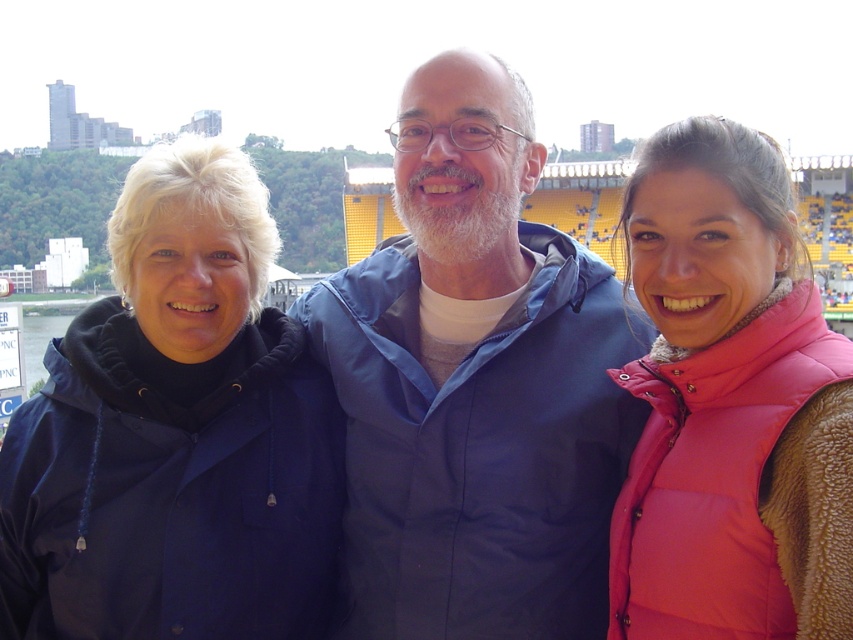
Identify the location of blue fabric jacket at center. The height and width of the screenshot is (640, 853). (474, 384).

This screenshot has width=853, height=640. Describe the element at coordinates (474, 384) in the screenshot. I see `blue fabric jacket at center` at that location.

Does point (387, 280) lie behind point (762, 432)?

That is True.

At what (x,y) coordinates should I click in order to perform the action: click on blue fabric jacket at center. Please return your answer as a coordinate pair (x, y). This screenshot has height=640, width=853. Looking at the image, I should click on (474, 384).

Between blue fabric jacket at center and navy blue jacket at left, which one is positioned higher?

blue fabric jacket at center is above.

Which of these two, blue fabric jacket at center or navy blue jacket at left, stands taller?

blue fabric jacket at center is taller.

Does point (405, 211) lie behind point (328, 509)?

Yes, it is behind point (328, 509).

At what (x,y) coordinates should I click in order to perform the action: click on blue fabric jacket at center. Please return your answer as a coordinate pair (x, y). Looking at the image, I should click on (474, 384).

Can you confirm if navy blue jacket at left is smaller than pink puffy vest at center?

Incorrect, navy blue jacket at left is not smaller in size than pink puffy vest at center.

Describe the element at coordinates (177, 433) in the screenshot. This screenshot has height=640, width=853. I see `navy blue jacket at left` at that location.

Locate an element on the screen. navy blue jacket at left is located at coordinates [177, 433].